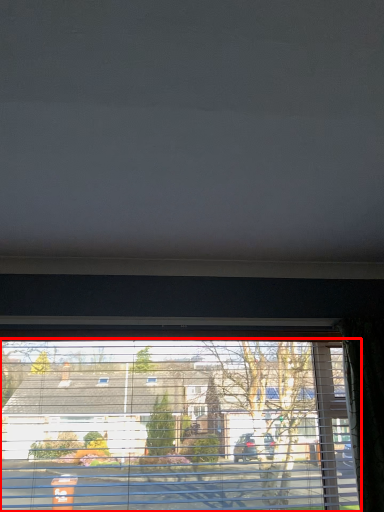
Question: From the image, what is the correct spatial relationship of window (annotated by the red box) in relation to blind?

Choices:
 (A) right
 (B) left

Answer: (B)